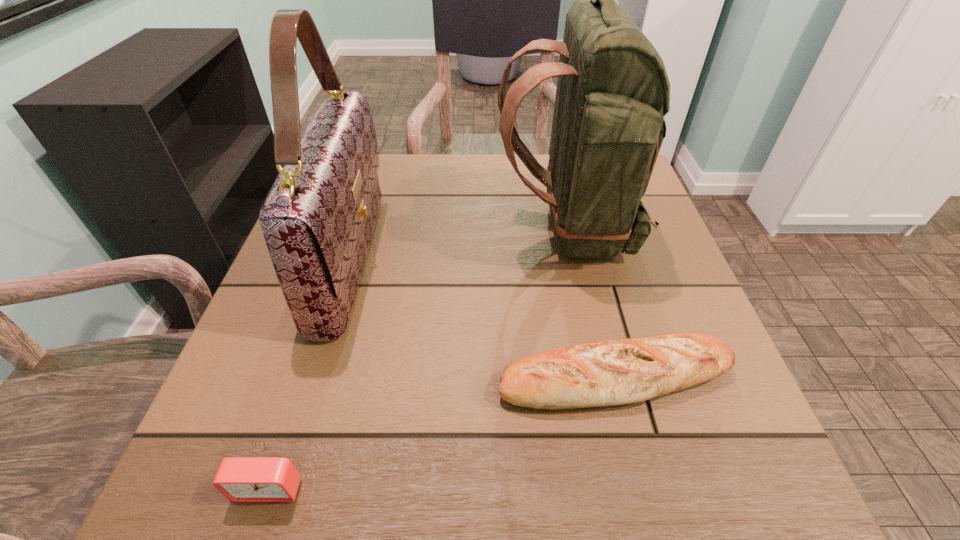
This screenshot has width=960, height=540. In order to click on free space in the image that satisfies the following two spatial constraints: 1. on the front of the baguet with the clasp; 2. on the left side of the handbag in this screenshot , I will do `click(314, 378)`.

I want to click on free space that satisfies the following two spatial constraints: 1. on the back of the backpack; 2. on the back side of the baguet, so click(x=600, y=378).

The height and width of the screenshot is (540, 960). I want to click on vacant region that satisfies the following two spatial constraints: 1. on the front of the handbag with the clasp; 2. on the front-facing side of the nearest object, so click(x=280, y=488).

Where is `free space in the image that satisfies the following two spatial constraints: 1. on the back of the backpack; 2. on the front-facing side of the alarm clock`? The width and height of the screenshot is (960, 540). free space in the image that satisfies the following two spatial constraints: 1. on the back of the backpack; 2. on the front-facing side of the alarm clock is located at coordinates (624, 488).

Identify the location of free space that satisfies the following two spatial constraints: 1. on the front of the handbag with the clasp; 2. on the front-facing side of the nearest object. The height and width of the screenshot is (540, 960). (280, 488).

The width and height of the screenshot is (960, 540). Find the location of `free space that satisfies the following two spatial constraints: 1. on the front of the handbag with the clasp; 2. on the front-facing side of the alarm clock`. free space that satisfies the following two spatial constraints: 1. on the front of the handbag with the clasp; 2. on the front-facing side of the alarm clock is located at coordinates (280, 488).

Locate an element on the screen. This screenshot has width=960, height=540. vacant point that satisfies the following two spatial constraints: 1. on the front of the handbag with the clasp; 2. on the front-facing side of the nearest object is located at coordinates (280, 488).